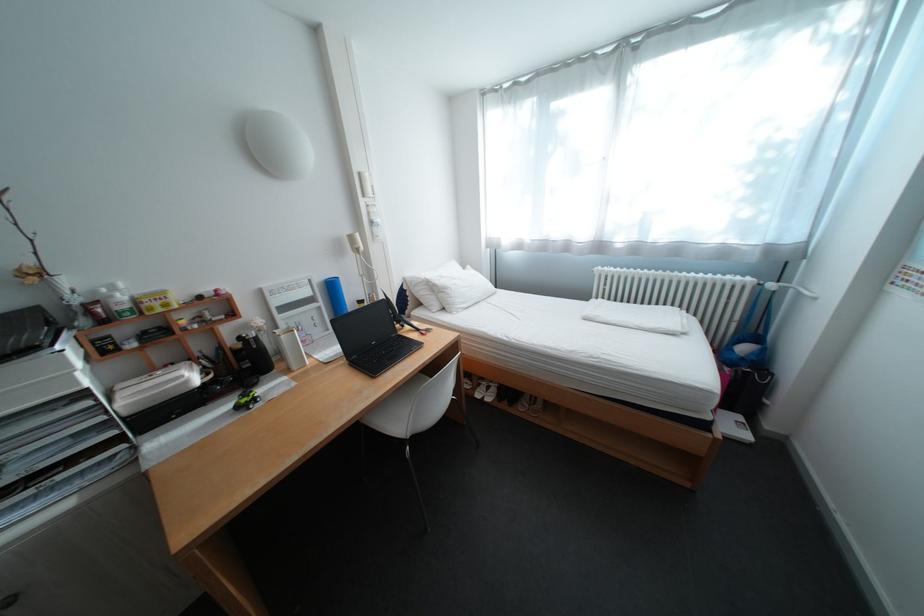
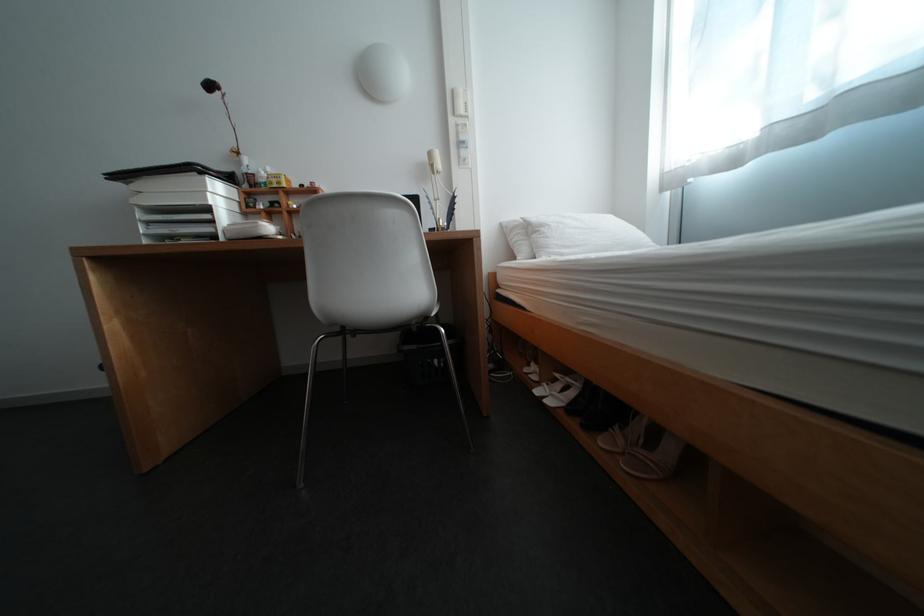
The point at (492, 386) is marked in the first image. Where is the corresponding point in the second image?

(568, 381)